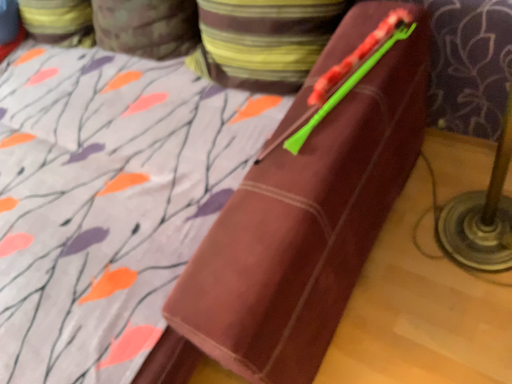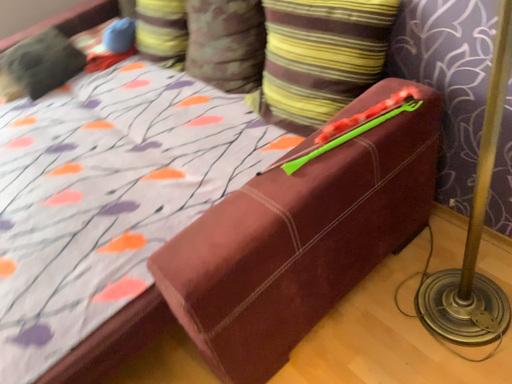
Question: How did the camera likely rotate when shooting the video?

Choices:
 (A) rotated left
 (B) rotated right

Answer: (A)